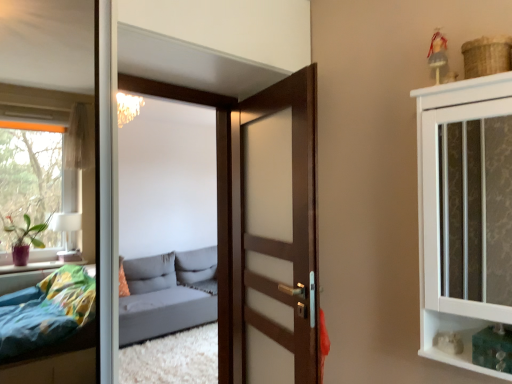
Question: Considering the positions of wooden door at center and gray fabric studio couch at center in the image, is wooden door at center taller or shorter than gray fabric studio couch at center?

Choices:
 (A) short
 (B) tall

Answer: (B)

Question: In terms of size, does wooden door at center appear bigger or smaller than gray fabric studio couch at center?

Choices:
 (A) small
 (B) big

Answer: (A)

Question: Based on their relative distances, which object is farther from the gray fabric studio couch at center?

Choices:
 (A) wooden door at center
 (B) white textured cabinet at upper right

Answer: (B)

Question: Considering the real-world distances, which object is closest to the gray fabric studio couch at center?

Choices:
 (A) wooden door at center
 (B) white textured cabinet at upper right

Answer: (A)